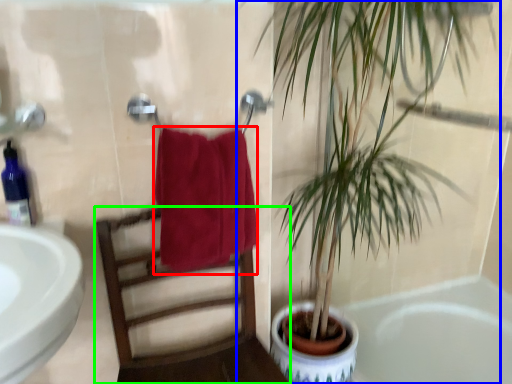
Question: Which is nearer to the towel/napkin (highlighted by a red box)? houseplant (highlighted by a blue box) or chair (highlighted by a green box).

Choices:
 (A) houseplant
 (B) chair

Answer: (B)